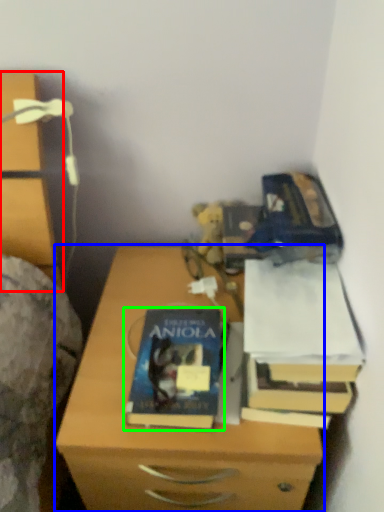
Question: Based on their relative distances, which object is nearer to chest of drawers (highlighted by a red box)? Choose from nightstand (highlighted by a blue box) and book (highlighted by a green box).

Choices:
 (A) nightstand
 (B) book

Answer: (A)